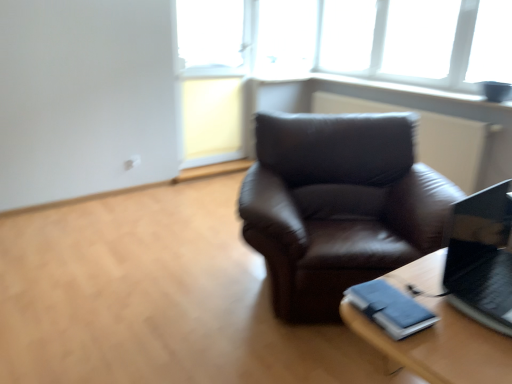
Question: Considering the relative positions of transparent glass window at upper center and wooden table at lower right in the image provided, is transparent glass window at upper center to the left of wooden table at lower right from the viewer's perspective?

Choices:
 (A) yes
 (B) no

Answer: (B)

Question: Could you tell me if transparent glass window at upper center is facing wooden table at lower right?

Choices:
 (A) yes
 (B) no

Answer: (B)

Question: From a real-world perspective, is transparent glass window at upper center located higher than wooden table at lower right?

Choices:
 (A) yes
 (B) no

Answer: (A)

Question: Would you consider transparent glass window at upper center to be distant from wooden table at lower right?

Choices:
 (A) yes
 (B) no

Answer: (A)

Question: From a real-world perspective, is transparent glass window at upper center below wooden table at lower right?

Choices:
 (A) no
 (B) yes

Answer: (A)

Question: Considering the positions of shiny black laptop at right and wooden table at lower right in the image, is shiny black laptop at right wider or thinner than wooden table at lower right?

Choices:
 (A) wide
 (B) thin

Answer: (B)

Question: Do you think shiny black laptop at right is within wooden table at lower right, or outside of it?

Choices:
 (A) inside
 (B) outside

Answer: (B)

Question: Does point (492, 233) appear closer or farther from the camera than point (437, 331)?

Choices:
 (A) farther
 (B) closer

Answer: (A)

Question: From the image's perspective, is shiny black laptop at right located above or below wooden table at lower right?

Choices:
 (A) above
 (B) below

Answer: (A)

Question: In terms of width, does shiny black laptop at right look wider or thinner when compared to transparent glass window at upper center?

Choices:
 (A) thin
 (B) wide

Answer: (B)

Question: In the image, is shiny black laptop at right on the left side or the right side of transparent glass window at upper center?

Choices:
 (A) left
 (B) right

Answer: (A)

Question: From the image's perspective, relative to transparent glass window at upper center, is shiny black laptop at right above or below?

Choices:
 (A) below
 (B) above

Answer: (A)

Question: Considering the positions of shiny black laptop at right and transparent glass window at upper center in the image, is shiny black laptop at right bigger or smaller than transparent glass window at upper center?

Choices:
 (A) big
 (B) small

Answer: (B)

Question: Does point (375, 71) appear closer or farther from the camera than point (505, 364)?

Choices:
 (A) closer
 (B) farther

Answer: (B)

Question: From the image's perspective, is transparent glass window at upper center located above or below wooden table at lower right?

Choices:
 (A) below
 (B) above

Answer: (B)